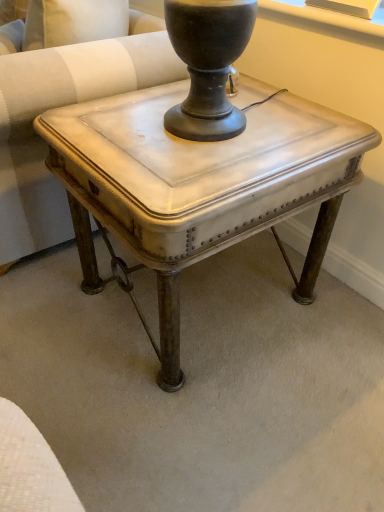
Where is `white leather swivel chair at center`? The height and width of the screenshot is (512, 384). white leather swivel chair at center is located at coordinates (62, 105).

What do you see at coordinates (62, 105) in the screenshot? This screenshot has height=512, width=384. I see `white leather swivel chair at center` at bounding box center [62, 105].

What do you see at coordinates (199, 184) in the screenshot? Image resolution: width=384 pixels, height=512 pixels. I see `white painted wood table at center` at bounding box center [199, 184].

You are a GUI agent. You are given a task and a screenshot of the screen. Output one action in this format:
    pyautogui.click(x=<x>, y=<y>)
    Task: Click on the white painted wood table at center
    Image resolution: width=384 pixels, height=512 pixels.
    Given the screenshot: What is the action you would take?
    (x=199, y=184)

I want to click on white leather swivel chair at center, so click(x=62, y=105).

Between white painted wood table at center and white leather swivel chair at center, which one appears on the right side from the viewer's perspective?

Positioned to the right is white painted wood table at center.

Is white painted wood table at center in front of or behind white leather swivel chair at center in the image?

In the image, white painted wood table at center appears in front of white leather swivel chair at center.

Considering the positions of points (183, 268) and (26, 232), is point (183, 268) farther from camera compared to point (26, 232)?

That is False.

Based on the photo, from the image's perspective, is white painted wood table at center over white leather swivel chair at center?

No, from the image's perspective, white painted wood table at center is not above white leather swivel chair at center.

From a real-world perspective, which object stands above the other?

white leather swivel chair at center.

From the picture: Considering the relative sizes of white painted wood table at center and white leather swivel chair at center in the image provided, is white painted wood table at center thinner than white leather swivel chair at center?

Yes.

Is white painted wood table at center shorter than white leather swivel chair at center?

Correct, white painted wood table at center is not as tall as white leather swivel chair at center.

Which of these two, white painted wood table at center or white leather swivel chair at center, is smaller?

With smaller size is white painted wood table at center.

Is white painted wood table at center inside or outside of white leather swivel chair at center?

white painted wood table at center is not enclosed by white leather swivel chair at center.

Are white painted wood table at center and white leather swivel chair at center making contact?

No, white painted wood table at center is not beside white leather swivel chair at center.

From the picture: Could you tell me if white painted wood table at center is facing white leather swivel chair at center?

No.

You are a GUI agent. You are given a task and a screenshot of the screen. Output one action in this format:
    pyautogui.click(x=<x>, y=<y>)
    Task: Click on the table below the white leather swivel chair at center (from a real-world perspective)
    
    Given the screenshot: What is the action you would take?
    pyautogui.click(x=199, y=184)

Is white leather swivel chair at center to the left of white painted wood table at center from the viewer's perspective?

Indeed, white leather swivel chair at center is positioned on the left side of white painted wood table at center.

Based on the photo, considering the relative positions of white leather swivel chair at center and white painted wood table at center in the image provided, is white leather swivel chair at center behind white painted wood table at center?

Yes, it is behind white painted wood table at center.

Considering the positions of point (136, 68) and point (300, 177), is point (136, 68) closer or farther from the camera than point (300, 177)?

Point (136, 68) appears to be farther away from the viewer than point (300, 177).

From the image's perspective, is white leather swivel chair at center positioned above or below white painted wood table at center?

white leather swivel chair at center is above white painted wood table at center.

From a real-world perspective, is white leather swivel chair at center physically below white painted wood table at center?

Actually, white leather swivel chair at center is physically above white painted wood table at center in the real world.

Does white leather swivel chair at center have a lesser width compared to white painted wood table at center?

No.

Does white leather swivel chair at center have a greater height compared to white painted wood table at center?

Indeed, white leather swivel chair at center has a greater height compared to white painted wood table at center.

Is white leather swivel chair at center bigger or smaller than white painted wood table at center?

Clearly, white leather swivel chair at center is larger in size than white painted wood table at center.

Is white painted wood table at center surrounded by white leather swivel chair at center?

Definitely not — white painted wood table at center is not inside white leather swivel chair at center.

Would you say white leather swivel chair at center is a long distance from white painted wood table at center?

No, white leather swivel chair at center is not far from white painted wood table at center.

Is white leather swivel chair at center oriented away from white painted wood table at center?

white leather swivel chair at center is not turned away from white painted wood table at center.

At what (x,y) coordinates should I click in order to perform the action: click on table below the white leather swivel chair at center (from the image's perspective). Please return your answer as a coordinate pair (x, y). Looking at the image, I should click on (199, 184).

The width and height of the screenshot is (384, 512). In order to click on table directly beneath the white leather swivel chair at center (from a real-world perspective) in this screenshot , I will do `click(199, 184)`.

This screenshot has height=512, width=384. In order to click on swivel chair on the left of the white painted wood table at center in this screenshot , I will do `click(62, 105)`.